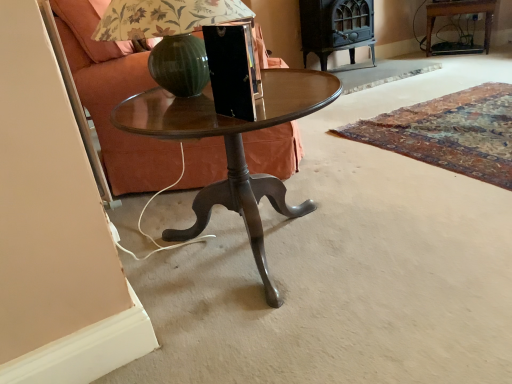
Identify the location of unoccupied region to the right of wooden glossy table at center. (422, 230).